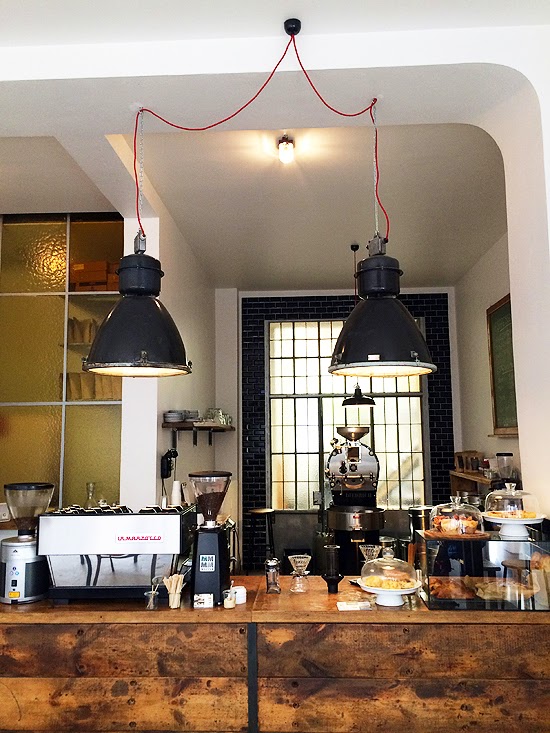
Identify the location of glass cover. (405, 561).